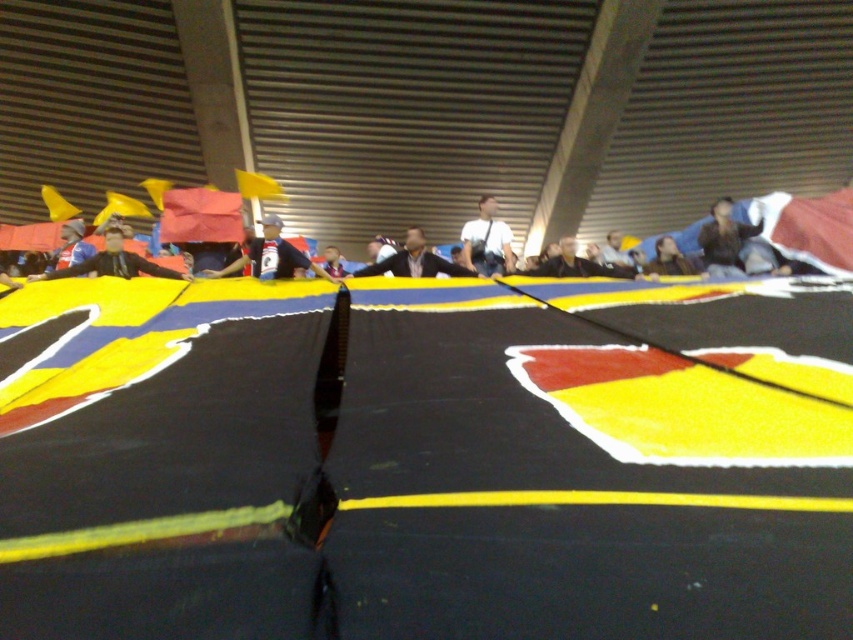
Where is `dark blue fabric at upper center`? This screenshot has height=640, width=853. dark blue fabric at upper center is located at coordinates (735, 244).

Does dark blue fabric at upper center come in front of smooth brown hair at center?

Yes.

Does point (746, 240) come behind point (695, 273)?

That is False.

Find the location of a particular element. This screenshot has height=640, width=853. dark blue fabric at upper center is located at coordinates (735, 244).

Does point (109, 260) lie behind point (399, 262)?

No.

Does matte black jacket at left appear under dark brown leather jacket at center?

Indeed, matte black jacket at left is positioned under dark brown leather jacket at center.

Measure the distance between matte black jacket at left and camera.

matte black jacket at left and camera are 5.76 meters apart.

Where is `matte black jacket at left`? matte black jacket at left is located at coordinates (112, 262).

Is yellow matte flag at center wider than yellow fabric flag at upper center?

Yes, yellow matte flag at center is wider than yellow fabric flag at upper center.

Is point (670, 451) farther from camera compared to point (260, 198)?

No, it is not.

Image resolution: width=853 pixels, height=640 pixels. In order to click on yellow matte flag at center in this screenshot , I will do `click(680, 410)`.